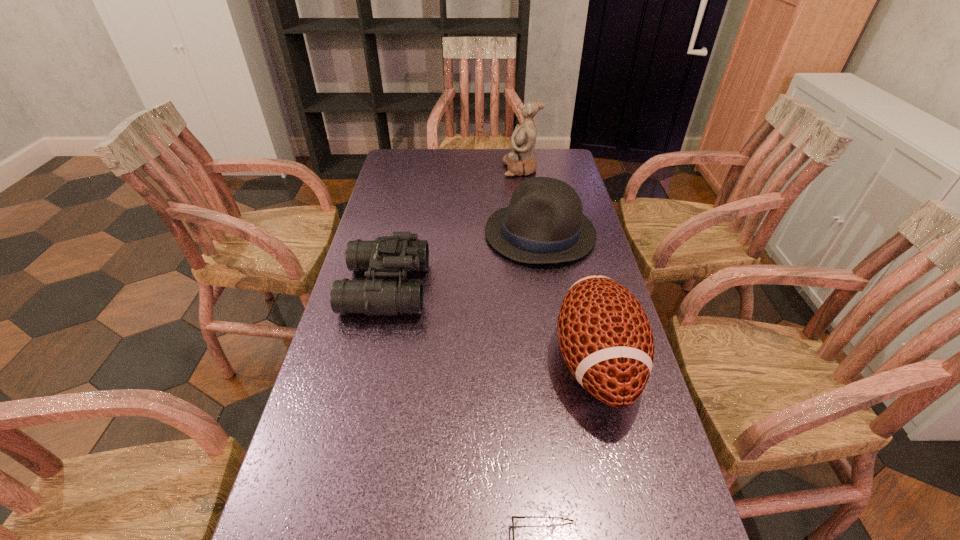
At what (x,y) coordinates should I click in order to perform the action: click on vacant region at the left edge of the desktop. Please return your answer as a coordinate pair (x, y). Looking at the image, I should click on (325, 523).

Find the location of a particular element. Image resolution: width=960 pixels, height=540 pixels. vacant space at the right edge of the desktop is located at coordinates (583, 194).

Where is `free spot at the far right corner of the desktop`? free spot at the far right corner of the desktop is located at coordinates (567, 166).

At what (x,y) coordinates should I click in order to perform the action: click on free spot between the football and the figurine. Please return your answer as a coordinate pair (x, y). Looking at the image, I should click on (559, 266).

The width and height of the screenshot is (960, 540). In order to click on free space between the leftmost object and the tallest object in this screenshot , I will do `click(453, 228)`.

Where is `free area in between the binoculars and the football`? free area in between the binoculars and the football is located at coordinates (492, 325).

Image resolution: width=960 pixels, height=540 pixels. What are the coordinates of `free space that is in between the leftmost object and the football` in the screenshot? It's located at (492, 325).

This screenshot has height=540, width=960. Find the location of `vacant space that is in between the tallest object and the leftmost object`. vacant space that is in between the tallest object and the leftmost object is located at coordinates (453, 228).

Find the location of a particular element. The image size is (960, 540). vacant area between the binoculars and the football is located at coordinates (492, 325).

I want to click on vacant region between the leftmost object and the tallest object, so click(453, 228).